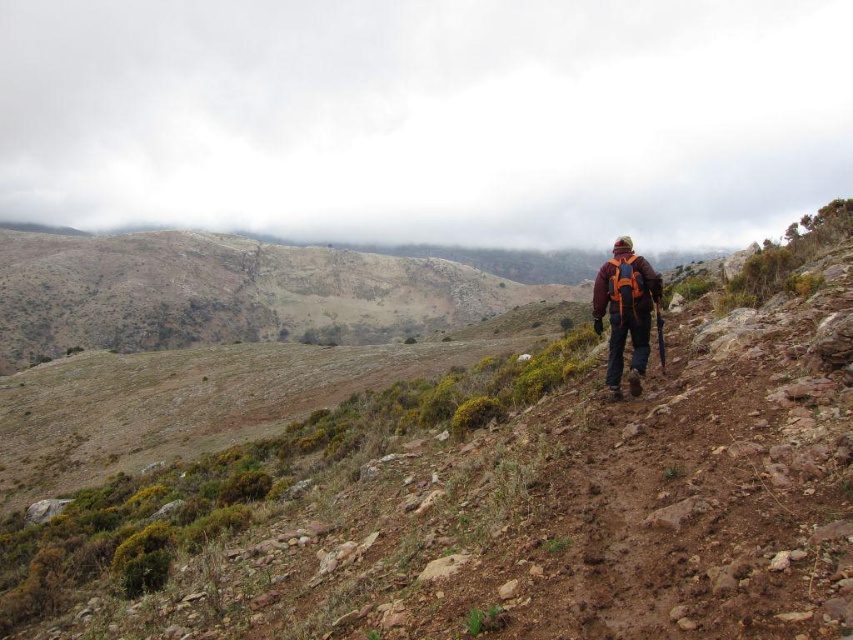
Question: Where is cloudy sky at upper center located in relation to orange fabric backpack at right in the image?

Choices:
 (A) below
 (B) above

Answer: (B)

Question: Is cloudy sky at upper center wider than orange fabric backpack at right?

Choices:
 (A) no
 (B) yes

Answer: (B)

Question: Is cloudy sky at upper center to the right of orange fabric backpack at right from the viewer's perspective?

Choices:
 (A) no
 (B) yes

Answer: (B)